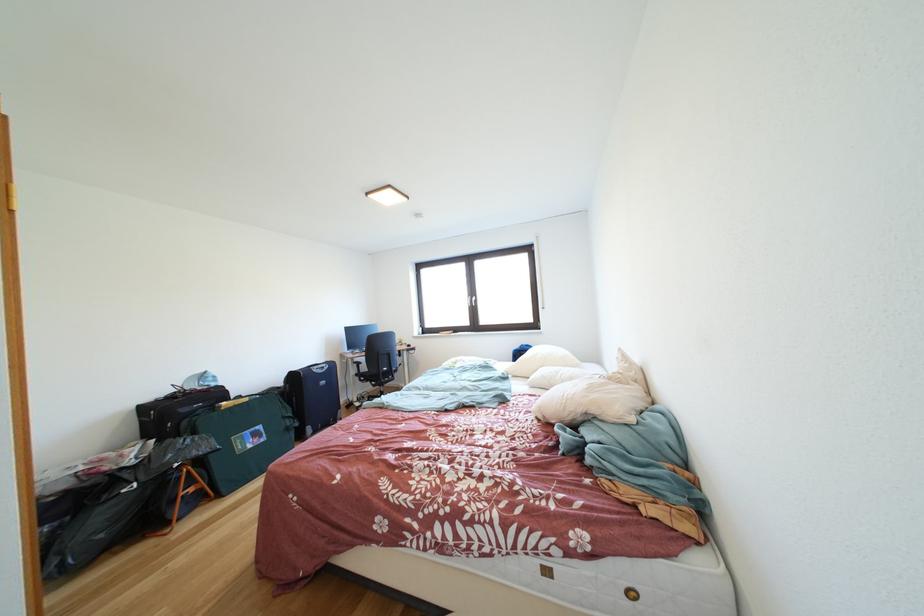
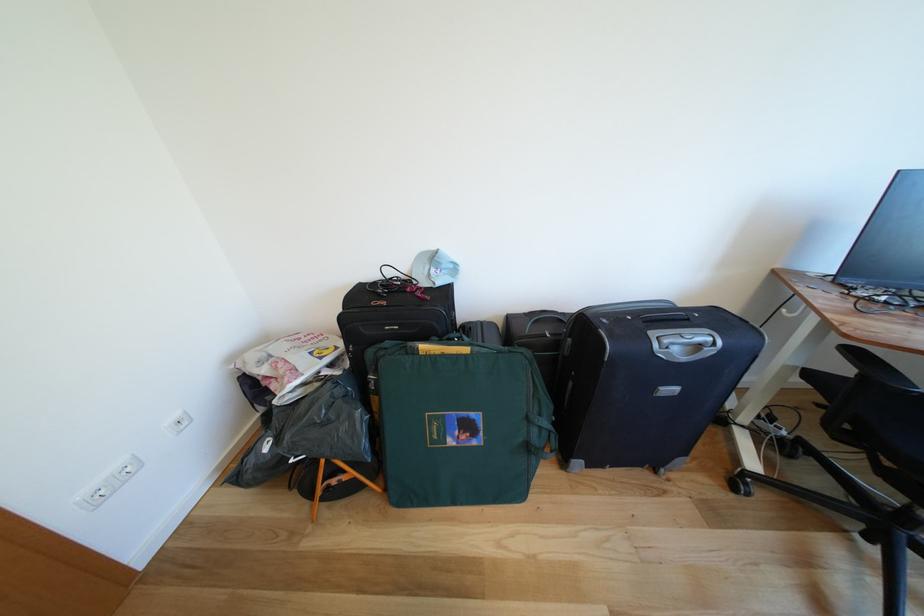
Locate, in the second image, the point that corresponds to (332,371) in the first image.

(707, 351)